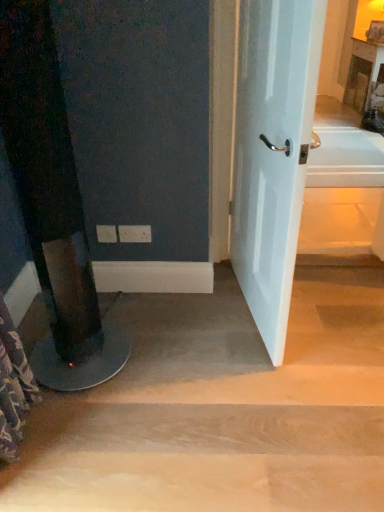
Question: From the image's perspective, is white glossy door at center over light brown wood at lower center?

Choices:
 (A) no
 (B) yes

Answer: (B)

Question: From a real-world perspective, is white glossy door at center located beneath light brown wood at lower center?

Choices:
 (A) yes
 (B) no

Answer: (B)

Question: Can you confirm if white glossy door at center is positioned to the left of light brown wood at lower center?

Choices:
 (A) yes
 (B) no

Answer: (B)

Question: Does white glossy door at center have a greater width compared to light brown wood at lower center?

Choices:
 (A) yes
 (B) no

Answer: (B)

Question: Is light brown wood at lower center inside white glossy door at center?

Choices:
 (A) no
 (B) yes

Answer: (A)

Question: Is white glossy door at center taller than light brown wood at lower center?

Choices:
 (A) no
 (B) yes

Answer: (B)

Question: From the image's perspective, is light brown wood at lower center on white glossy door at center?

Choices:
 (A) yes
 (B) no

Answer: (B)

Question: Considering the relative positions of light brown wood at lower center and white glossy door at center in the image provided, is light brown wood at lower center to the right of white glossy door at center from the viewer's perspective?

Choices:
 (A) no
 (B) yes

Answer: (A)

Question: Is light brown wood at lower center wider than white glossy door at center?

Choices:
 (A) no
 (B) yes

Answer: (B)

Question: Is light brown wood at lower center taller than white glossy door at center?

Choices:
 (A) yes
 (B) no

Answer: (B)

Question: Is the position of light brown wood at lower center more distant than that of white glossy door at center?

Choices:
 (A) yes
 (B) no

Answer: (A)

Question: From the image's perspective, is light brown wood at lower center under white glossy door at center?

Choices:
 (A) yes
 (B) no

Answer: (A)

Question: Is light brown wood at lower center bigger or smaller than white glossy door at center?

Choices:
 (A) big
 (B) small

Answer: (A)